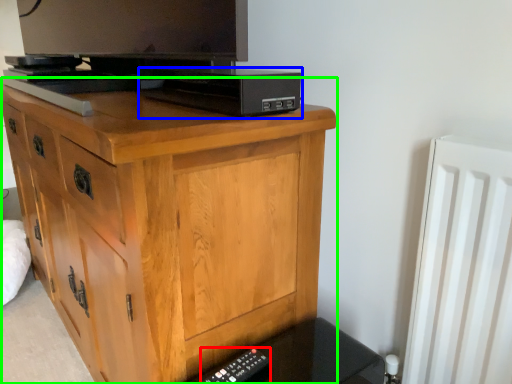
Question: Based on their relative distances, which object is nearer to remote (highlighted by a red box)? Choose from computer (highlighted by a blue box) and chest of drawers (highlighted by a green box).

Choices:
 (A) computer
 (B) chest of drawers

Answer: (B)